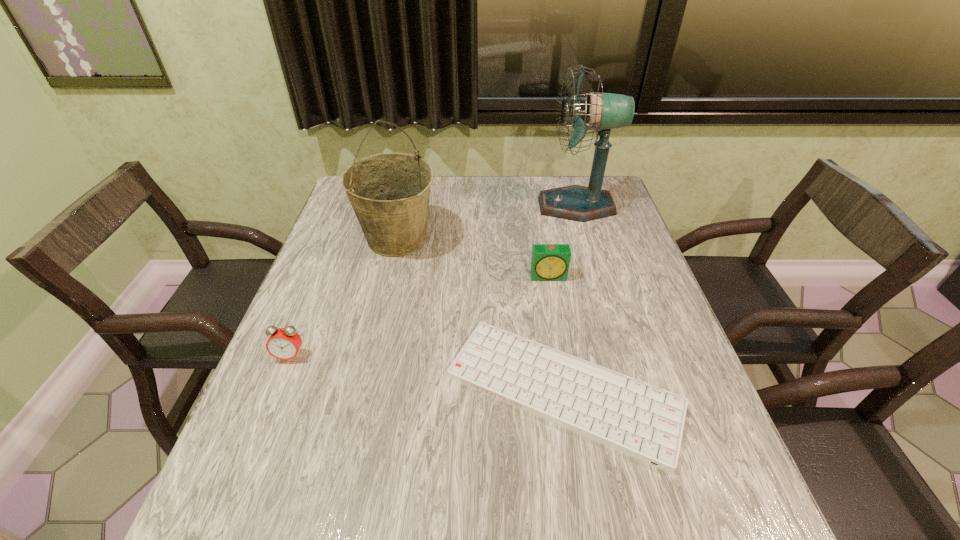
In order to click on fan in this screenshot , I will do `click(603, 111)`.

Find the location of `the fourth object from right to left`. the fourth object from right to left is located at coordinates (389, 192).

The height and width of the screenshot is (540, 960). Identify the location of wine bucket. (389, 192).

Where is `the right alarm clock`? This screenshot has width=960, height=540. the right alarm clock is located at coordinates (550, 262).

This screenshot has height=540, width=960. I want to click on the farther alarm clock, so click(x=550, y=262).

At what (x,y) coordinates should I click in order to perform the action: click on the left alarm clock. Please return your answer as a coordinate pair (x, y). This screenshot has width=960, height=540. Looking at the image, I should click on [284, 343].

Find the location of `the leftmost object`. the leftmost object is located at coordinates (284, 343).

This screenshot has height=540, width=960. I want to click on the shortest object, so click(643, 421).

This screenshot has width=960, height=540. I want to click on free space located in front of the tallest object where the wind blows, so click(524, 206).

In order to click on free space located 0.120m in front of the tallest object where the wind blows in this screenshot , I will do `click(502, 206)`.